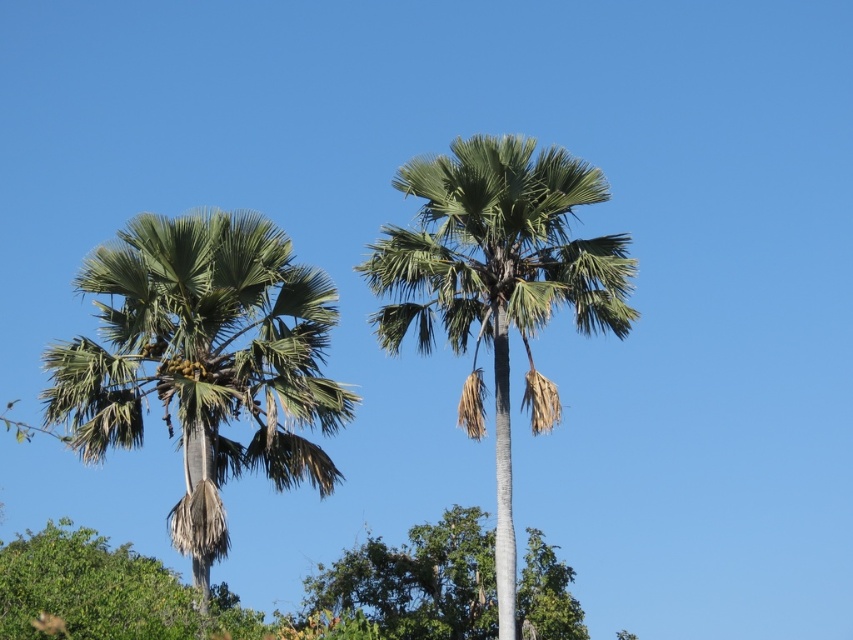
Question: Does green leafy palm at center appear over green leafy tree at center?

Choices:
 (A) yes
 (B) no

Answer: (A)

Question: Which point is farther to the camera?

Choices:
 (A) (454, 259)
 (B) (315, 371)

Answer: (A)

Question: Which point is farther from the camera taking this photo?

Choices:
 (A) 119,442
 (B) 329,592
 (C) 511,634

Answer: (B)

Question: Is green leafy palm at left above green leafy palm at center?

Choices:
 (A) yes
 (B) no

Answer: (B)

Question: Estimate the real-world distances between objects in this image. Which object is closer to the green leafy palm at left?

Choices:
 (A) green leafy tree at center
 (B) green leafy palm at center

Answer: (B)

Question: Is green leafy palm at left wider than green leafy tree at center?

Choices:
 (A) yes
 (B) no

Answer: (B)